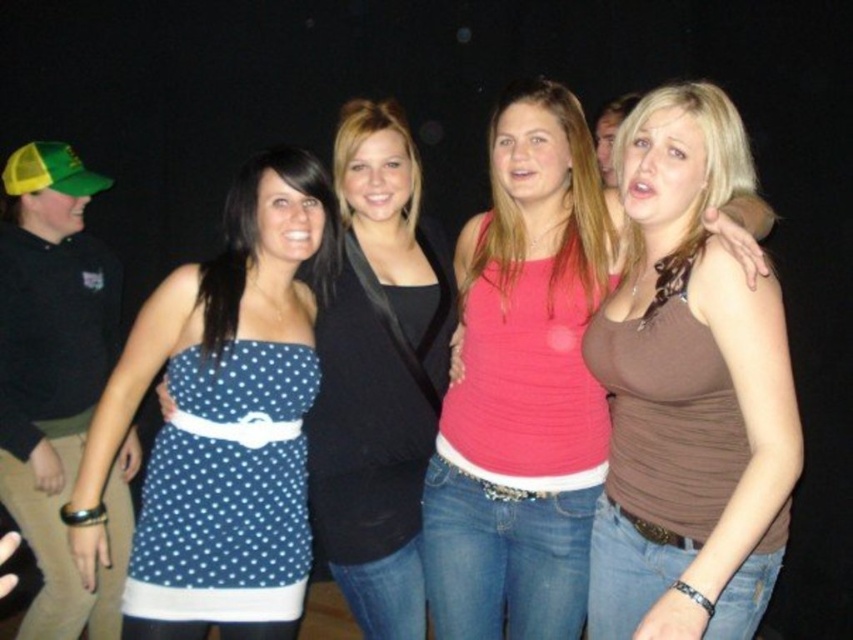
The height and width of the screenshot is (640, 853). What do you see at coordinates (523, 384) in the screenshot?
I see `brown matte tank top at center` at bounding box center [523, 384].

Which is behind, point (738, 211) or point (390, 406)?

The point (390, 406) is behind.

The image size is (853, 640). I want to click on brown matte tank top at center, so click(523, 384).

Does blue polka dot dress at left have a greater height compared to blue polka dot dress at center?

No.

Can you confirm if blue polka dot dress at left is wider than blue polka dot dress at center?

Correct, the width of blue polka dot dress at left exceeds that of blue polka dot dress at center.

At what (x,y) coordinates should I click in order to perform the action: click on blue polka dot dress at left. Please return your answer as a coordinate pair (x, y). Looking at the image, I should click on (221, 419).

Between brown matte tank top at center and blue polka dot dress at left, which one has less height?

Standing shorter between the two is blue polka dot dress at left.

Is brown matte tank top at center taller than blue polka dot dress at left?

Correct, brown matte tank top at center is much taller as blue polka dot dress at left.

Is point (526, 228) more distant than point (107, 410)?

That is True.

Identify the location of brown matte tank top at center. (523, 384).